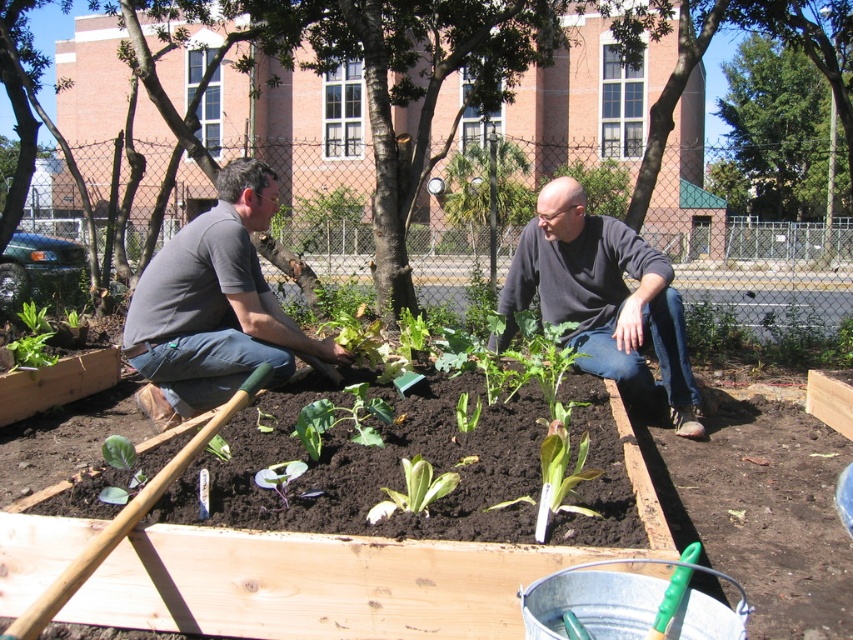
Which is more to the left, gray cotton shirt at center or dark gray sweater at center?

From the viewer's perspective, gray cotton shirt at center appears more on the left side.

Image resolution: width=853 pixels, height=640 pixels. Describe the element at coordinates (213, 307) in the screenshot. I see `gray cotton shirt at center` at that location.

Where is `gray cotton shirt at center`? gray cotton shirt at center is located at coordinates (213, 307).

Who is positioned more to the right, dark gray t-shirt at center or green leafy plant at center?

dark gray t-shirt at center

Does dark gray t-shirt at center have a greater width compared to green leafy plant at center?

Indeed, dark gray t-shirt at center has a greater width compared to green leafy plant at center.

The width and height of the screenshot is (853, 640). What are the coordinates of `dark gray t-shirt at center` in the screenshot? It's located at (602, 298).

In the scene shown: Does dark gray t-shirt at center lie in front of gray cotton shirt at center?

No, it is behind gray cotton shirt at center.

How distant is dark gray t-shirt at center from gray cotton shirt at center?

They are 1.67 meters apart.

The width and height of the screenshot is (853, 640). I want to click on dark gray t-shirt at center, so click(602, 298).

Find the location of a particular element. This screenshot has width=853, height=640. dark gray t-shirt at center is located at coordinates (602, 298).